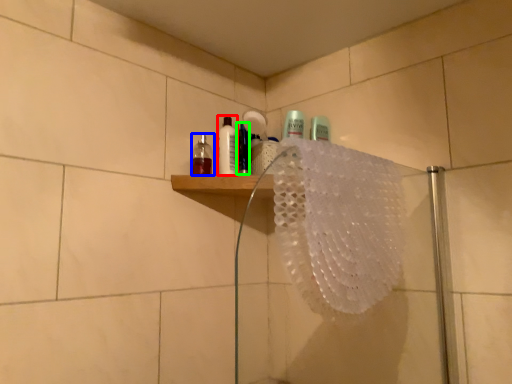
Question: Considering the real-world distances, which object is closest to mouthwash (highlighted by a red box)? mouthwash (highlighted by a blue box) or mouthwash (highlighted by a green box).

Choices:
 (A) mouthwash
 (B) mouthwash

Answer: (B)